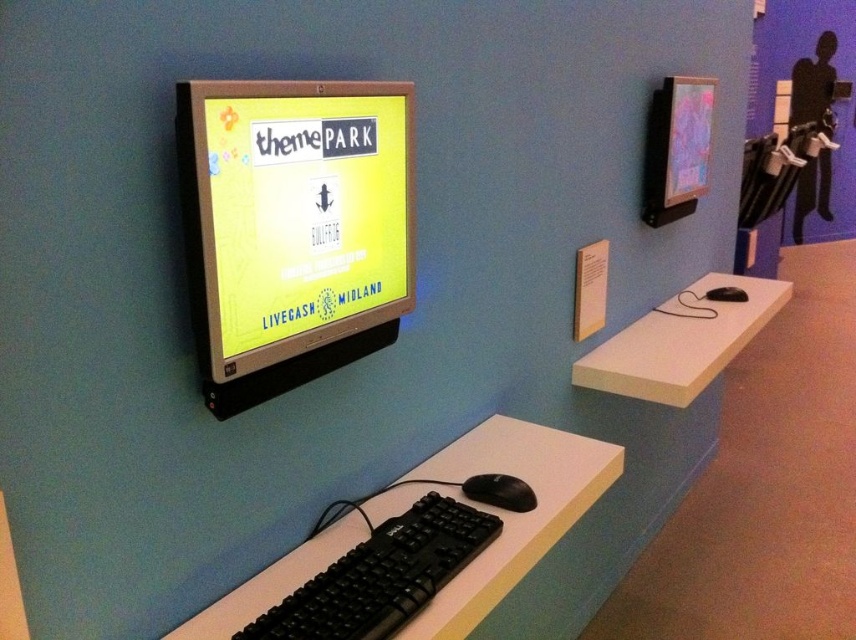
Is point (415, 541) closer to camera compared to point (515, 476)?

Yes, point (415, 541) is in front of point (515, 476).

Which is below, black plastic keyboard at lower center or black matte mouse at lower center?

black plastic keyboard at lower center is lower down.

You are a GUI agent. You are given a task and a screenshot of the screen. Output one action in this format:
    pyautogui.click(x=<x>, y=<y>)
    Task: Click on the black plastic keyboard at lower center
    
    Given the screenshot: What is the action you would take?
    tap(382, 576)

Is point (290, 582) closer to camera compared to point (385, 616)?

That is False.

Is black plastic keyboard and mouse at lower center in front of black plastic keyboard at lower center?

No, black plastic keyboard and mouse at lower center is further to the viewer.

Is point (348, 525) positioned behind point (363, 634)?

That is True.

You are a GUI agent. You are given a task and a screenshot of the screen. Output one action in this format:
    pyautogui.click(x=<x>, y=<y>)
    Task: Click on the black plastic keyboard and mouse at lower center
    This screenshot has width=856, height=640.
    Given the screenshot: What is the action you would take?
    pyautogui.click(x=503, y=509)

Does matte black monitor at center have a greater width compared to black plastic keyboard at lower center?

Incorrect, matte black monitor at center's width does not surpass black plastic keyboard at lower center's.

At what (x,y) coordinates should I click in order to perform the action: click on matte black monitor at center. Please return your answer as a coordinate pair (x, y). The image size is (856, 640). Looking at the image, I should click on (294, 227).

The image size is (856, 640). Describe the element at coordinates (294, 227) in the screenshot. I see `matte black monitor at center` at that location.

Identify the location of matte black monitor at center. The width and height of the screenshot is (856, 640). (294, 227).